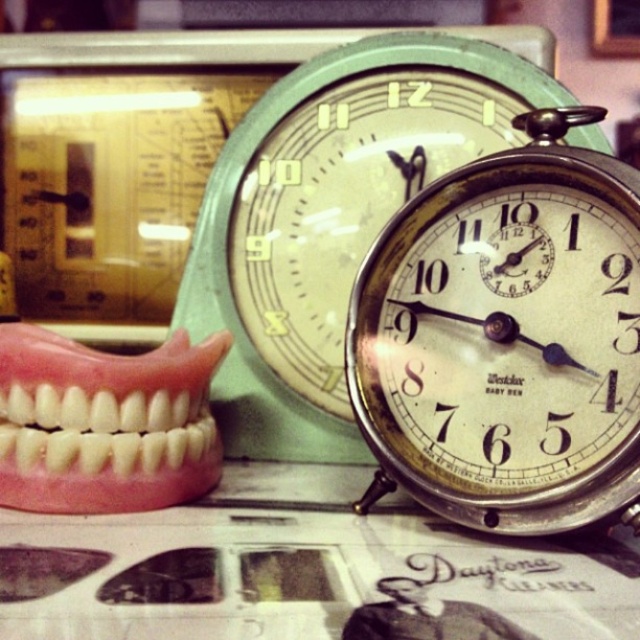
You are a dentist examining the metallic silver alarm clock at center and the pink rubber denture at left. Which object is taller?

The metallic silver alarm clock at center is much taller than the pink rubber denture at left.

You are organizing a display of vintage items on a table. You have a metallic silver alarm clock at center and a pink rubber denture at left. Which item is positioned higher on the table?

The metallic silver alarm clock at center is located above the pink rubber denture at left, so it is positioned higher on the table.

You are organizing the items on the table and need to place a new item between the metallic silver alarm clock at center and the pink rubber denture at left. Is there enough space between them for the new item?

The metallic silver alarm clock at center is in front of the pink rubber denture at left, so there is space between them to place a new item.